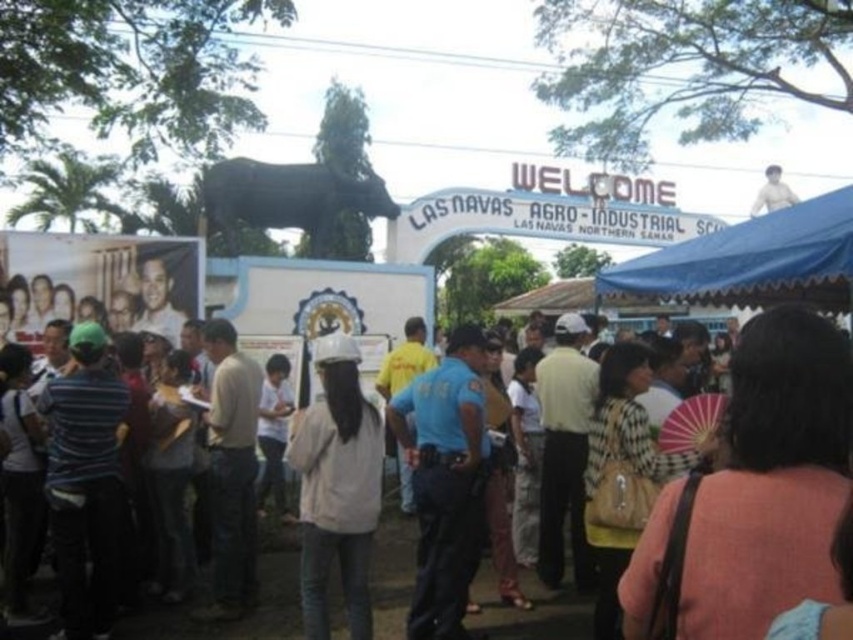
Which is more to the right, blue uniformed officer at center or black matte statue at upper center?

blue uniformed officer at center is more to the right.

Which is in front, point (469, 477) or point (207, 188)?

Point (469, 477) is in front.

Where is `blue uniformed officer at center`? blue uniformed officer at center is located at coordinates (445, 481).

Can you confirm if blue uniformed officer at center is positioned below white matte hard hat at center?

Actually, blue uniformed officer at center is above white matte hard hat at center.

Is blue uniformed officer at center to the left of white matte hard hat at center from the viewer's perspective?

In fact, blue uniformed officer at center is to the right of white matte hard hat at center.

Who is more forward, (463, 522) or (323, 365)?

Point (463, 522) is more forward.

Where is `blue uniformed officer at center`? The height and width of the screenshot is (640, 853). blue uniformed officer at center is located at coordinates (445, 481).

Between blue fabric canopy at upper right and black matte statue at upper center, which one appears on the right side from the viewer's perspective?

Positioned to the right is blue fabric canopy at upper right.

Is blue fabric canopy at upper right wider than black matte statue at upper center?

Yes, blue fabric canopy at upper right is wider than black matte statue at upper center.

Locate an element on the screen. The image size is (853, 640). blue fabric canopy at upper right is located at coordinates (753, 260).